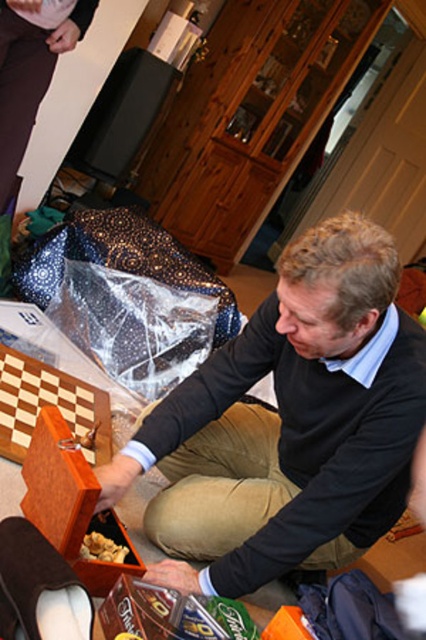
Question: Which point is closer to the camera?

Choices:
 (A) (115, 557)
 (B) (0, 376)
 (C) (313, 372)

Answer: (A)

Question: Which of the following is the closest to the observer?

Choices:
 (A) matte black sweater at center
 (B) brown crumbly food at lower center
 (C) wooden chess at lower left
 (D) wooden box at center

Answer: (A)

Question: Is matte black sweater at center closer to camera compared to wooden box at center?

Choices:
 (A) yes
 (B) no

Answer: (A)

Question: Among these points, which one is farthest from the camera?

Choices:
 (A) (66, 438)
 (B) (98, 538)

Answer: (B)

Question: Can you confirm if wooden box at center is positioned to the left of wooden chess at lower left?

Choices:
 (A) yes
 (B) no

Answer: (B)

Question: Does matte black sweater at center lie behind wooden chess at lower left?

Choices:
 (A) no
 (B) yes

Answer: (A)